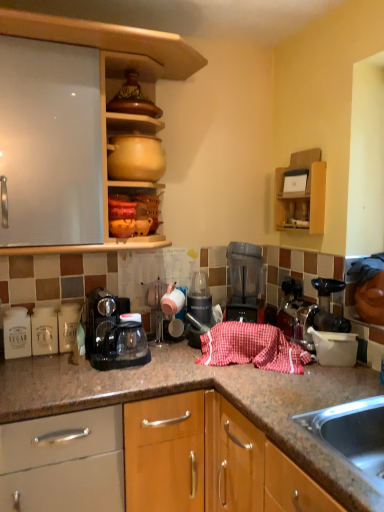
How much space does wooden shelf at upper right, which is counted as the 2th cabinetry, starting from the left, occupy horizontally?

3.56 inches.

Describe the element at coordinates (252, 347) in the screenshot. I see `red checkered cloth at center` at that location.

Measure the distance between point (284, 343) and camera.

Point (284, 343) and camera are 5.81 feet apart from each other.

Describe the element at coordinates (200, 298) in the screenshot. I see `black plastic blender at center, the first appliance in the right-to-left sequence` at that location.

The image size is (384, 512). I want to click on matte ceramic pots at upper center, placed as the first cabinetry when sorted from left to right, so click(x=111, y=42).

What do you see at coordinates (111, 42) in the screenshot?
I see `matte ceramic pots at upper center, the 2th cabinetry from the right` at bounding box center [111, 42].

The image size is (384, 512). I want to click on wooden shelf at upper right, which is the 1th cabinetry in right-to-left order, so click(302, 194).

From the image's perspective, which one is positioned lower, black plastic coffee maker at center or matte yellow clay pot at upper center, placed as the 1th appliance when sorted from left to right?

black plastic coffee maker at center.

Is point (93, 298) closer or farther from the camera than point (154, 150)?

Point (93, 298) is farther from the camera than point (154, 150).

What are the coordinates of `home appliance in front of the matte yellow clay pot at upper center, placed as the 1th appliance when sorted from left to right` in the screenshot? It's located at (113, 333).

Does black plastic coffee maker at center lie behind matte yellow clay pot at upper center, which is the 1th appliance from front to back?

No, black plastic coffee maker at center is closer to the camera.

Does point (205, 293) appear closer or farther from the camera than point (322, 192)?

Clearly, point (205, 293) is more distant from the camera than point (322, 192).

In the scene shown: In terms of height, does black plastic blender at center, the first appliance from the bottom, look taller or shorter compared to wooden shelf at upper right, which is the 1th cabinetry in right-to-left order?

In the image, black plastic blender at center, the first appliance from the bottom, appears to be shorter than wooden shelf at upper right, which is the 1th cabinetry in right-to-left order.

Is black plastic blender at center, arranged as the 2th appliance when viewed from the left, aimed at wooden shelf at upper right, which is the 1th cabinetry in right-to-left order?

No, black plastic blender at center, arranged as the 2th appliance when viewed from the left, does not turn towards wooden shelf at upper right, which is the 1th cabinetry in right-to-left order.

Measure the distance from black plastic blender at center, the 2th appliance from the top, to wooden shelf at upper right, which is the 1th cabinetry in right-to-left order.

23.24 inches.

Based on the photo, which object is further away from the camera taking this photo, black plastic blender at center, which ranks as the second appliance in front-to-back order, or matte yellow clay pot at upper center, which is the 1th appliance from front to back?

Positioned behind is black plastic blender at center, which ranks as the second appliance in front-to-back order.

Does black plastic blender at center, arranged as the 2th appliance when viewed from the left, have a lesser width compared to matte yellow clay pot at upper center, which is counted as the 2th appliance, starting from the bottom?

Indeed, black plastic blender at center, arranged as the 2th appliance when viewed from the left, has a lesser width compared to matte yellow clay pot at upper center, which is counted as the 2th appliance, starting from the bottom.

Is black plastic blender at center, the first appliance from the bottom, positioned beyond the bounds of matte yellow clay pot at upper center, the second appliance when ordered from right to left?

That's correct, black plastic blender at center, the first appliance from the bottom, is outside of matte yellow clay pot at upper center, the second appliance when ordered from right to left.

Is matte yellow clay pot at upper center, the first appliance positioned from the top, directly adjacent to red checkered cloth at center?

No, matte yellow clay pot at upper center, the first appliance positioned from the top, is not making contact with red checkered cloth at center.

Can we say matte yellow clay pot at upper center, placed as the 1th appliance when sorted from left to right, lies outside red checkered cloth at center?

matte yellow clay pot at upper center, placed as the 1th appliance when sorted from left to right, is positioned outside red checkered cloth at center.

Measure the distance from matte yellow clay pot at upper center, the first appliance positioned from the top, to red checkered cloth at center.

matte yellow clay pot at upper center, the first appliance positioned from the top, and red checkered cloth at center are 79.19 centimeters apart.

Is matte yellow clay pot at upper center, the second appliance when ordered from right to left, bigger than red checkered cloth at center?

Actually, matte yellow clay pot at upper center, the second appliance when ordered from right to left, might be smaller than red checkered cloth at center.

Considering the relative sizes of matte ceramic pots at upper center, placed as the first cabinetry when sorted from left to right, and wooden shelf at upper right, which is counted as the 2th cabinetry, starting from the left, in the image provided, is matte ceramic pots at upper center, placed as the first cabinetry when sorted from left to right, thinner than wooden shelf at upper right, which is counted as the 2th cabinetry, starting from the left,?

In fact, matte ceramic pots at upper center, placed as the first cabinetry when sorted from left to right, might be wider than wooden shelf at upper right, which is counted as the 2th cabinetry, starting from the left.

Does point (64, 38) lie behind point (296, 202)?

No, it is in front of (296, 202).

From the image's perspective, would you say matte ceramic pots at upper center, placed as the first cabinetry when sorted from left to right, is positioned over wooden shelf at upper right, which is counted as the 2th cabinetry, starting from the left?

Indeed, from the image's perspective, matte ceramic pots at upper center, placed as the first cabinetry when sorted from left to right, is shown above wooden shelf at upper right, which is counted as the 2th cabinetry, starting from the left.

Does translucent plastic blender at center have a lesser width compared to matte ceramic pots at upper center, placed as the first cabinetry when sorted from left to right?

Yes.

Considering the points (245, 266) and (119, 114), which point is behind, point (245, 266) or point (119, 114)?

Point (245, 266)

From the image's perspective, would you say translucent plastic blender at center is positioned over matte ceramic pots at upper center, the 2th cabinetry from the right?

Incorrect, from the image's perspective, translucent plastic blender at center is lower than matte ceramic pots at upper center, the 2th cabinetry from the right.

Is translucent plastic blender at center taller than matte ceramic pots at upper center, placed as the first cabinetry when sorted from left to right?

In fact, translucent plastic blender at center may be shorter than matte ceramic pots at upper center, placed as the first cabinetry when sorted from left to right.

Is there a large distance between translucent plastic blender at center and red checkered cloth at center?

No, translucent plastic blender at center is not far from red checkered cloth at center.

In the scene shown: What's the angular difference between translucent plastic blender at center and red checkered cloth at center's facing directions?

1.13 degrees.

Find the location of `kitchen appliance to the right of red checkered cloth at center`. kitchen appliance to the right of red checkered cloth at center is located at coordinates (245, 282).

Which is behind, translucent plastic blender at center or red checkered cloth at center?

Positioned behind is translucent plastic blender at center.

The width and height of the screenshot is (384, 512). Identify the location of appliance that is the 2nd object located above the black plastic coffee maker at center (from the image's perspective). (135, 158).

Image resolution: width=384 pixels, height=512 pixels. In the image, there is a wooden shelf at upper right, which is the 1th cabinetry in right-to-left order. Find the location of `appliance below it (from a real-world perspective)`. appliance below it (from a real-world perspective) is located at coordinates (200, 298).

Considering their positions, is matte yellow clay pot at upper center, the second appliance when ordered from right to left, positioned further to red checkered cloth at center than matte ceramic pots at upper center, placed as the first cabinetry when sorted from left to right?

matte ceramic pots at upper center, placed as the first cabinetry when sorted from left to right, is positioned further to the anchor red checkered cloth at center.

When comparing their distances from translucent plastic blender at center, does matte ceramic pots at upper center, placed as the first cabinetry when sorted from left to right, or black plastic coffee maker at center seem further?

matte ceramic pots at upper center, placed as the first cabinetry when sorted from left to right, lies further to translucent plastic blender at center than the other object.

Estimate the real-world distances between objects in this image. Which object is closer to wooden shelf at upper right, which is the 1th cabinetry in right-to-left order, red checkered cloth at center or matte yellow clay pot at upper center, which is the 1th appliance from front to back?

red checkered cloth at center is closer to wooden shelf at upper right, which is the 1th cabinetry in right-to-left order.

Considering their positions, is wooden shelf at upper right, which is counted as the 2th cabinetry, starting from the left, positioned closer to red checkered cloth at center than black plastic blender at center, the first appliance in the right-to-left sequence?

black plastic blender at center, the first appliance in the right-to-left sequence, is positioned closer to the anchor red checkered cloth at center.

Based on their spatial positions, is matte ceramic pots at upper center, the 2th cabinetry from the right, or red checkered cloth at center closer to black plastic blender at center, the 2th appliance from the top?

red checkered cloth at center.

From the picture: Based on their spatial positions, is black plastic coffee maker at center or red checkered cloth at center closer to matte ceramic pots at upper center, the 2th cabinetry from the right?

black plastic coffee maker at center is positioned closer to the anchor matte ceramic pots at upper center, the 2th cabinetry from the right.

Looking at the image, which one is located further to wooden shelf at upper right, which is the 1th cabinetry in right-to-left order, translucent plastic blender at center or matte ceramic pots at upper center, the 2th cabinetry from the right?

matte ceramic pots at upper center, the 2th cabinetry from the right, is positioned further to the anchor wooden shelf at upper right, which is the 1th cabinetry in right-to-left order.

When comparing their distances from translucent plastic blender at center, does wooden shelf at upper right, which is the 1th cabinetry in right-to-left order, or matte yellow clay pot at upper center, the first appliance positioned from the top, seem further?

Among the two, matte yellow clay pot at upper center, the first appliance positioned from the top, is located further to translucent plastic blender at center.

Image resolution: width=384 pixels, height=512 pixels. I want to click on appliance between matte yellow clay pot at upper center, placed as the 1th appliance when sorted from left to right, and wooden shelf at upper right, which is the 1th cabinetry in right-to-left order, in the horizontal direction, so click(200, 298).

This screenshot has width=384, height=512. In order to click on kitchen appliance that lies between matte ceramic pots at upper center, placed as the first cabinetry when sorted from left to right, and black plastic coffee maker at center from top to bottom in this screenshot , I will do `click(245, 282)`.

At what (x,y) coordinates should I click in order to perform the action: click on blanket between black plastic coffee maker at center and translucent plastic blender at center in the horizontal direction. Please return your answer as a coordinate pair (x, y). The height and width of the screenshot is (512, 384). Looking at the image, I should click on (x=252, y=347).

Where is `kitchen appliance between matte yellow clay pot at upper center, which is the 2th appliance in back-to-front order, and red checkered cloth at center vertically`? Image resolution: width=384 pixels, height=512 pixels. kitchen appliance between matte yellow clay pot at upper center, which is the 2th appliance in back-to-front order, and red checkered cloth at center vertically is located at coordinates (245, 282).